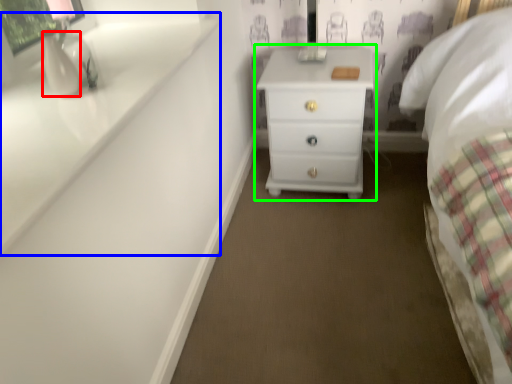
Question: Which object is the farthest from vase (highlighted by a red box)? Choose among these: window sill (highlighted by a blue box) or chest of drawers (highlighted by a green box).

Choices:
 (A) window sill
 (B) chest of drawers

Answer: (B)